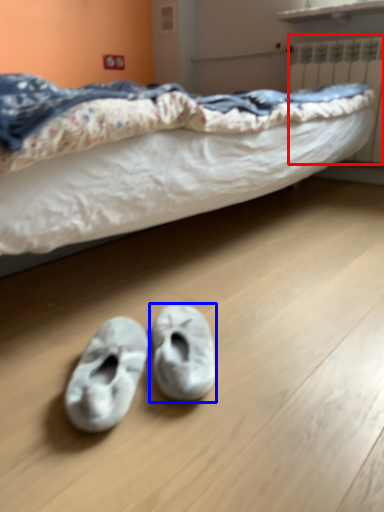
Question: Among these objects, which one is farthest to the camera, radiator (highlighted by a red box) or footwear (highlighted by a blue box)?

Choices:
 (A) radiator
 (B) footwear

Answer: (A)